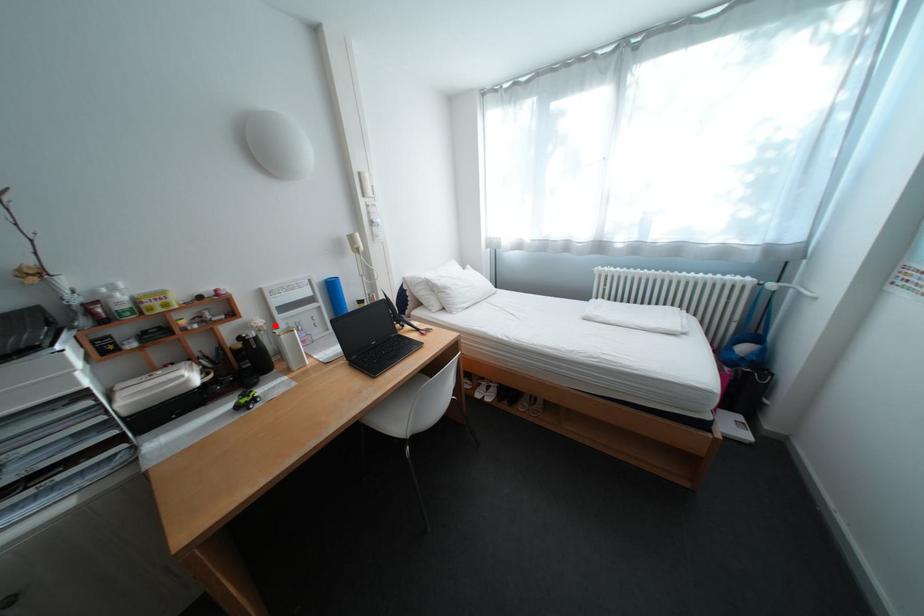
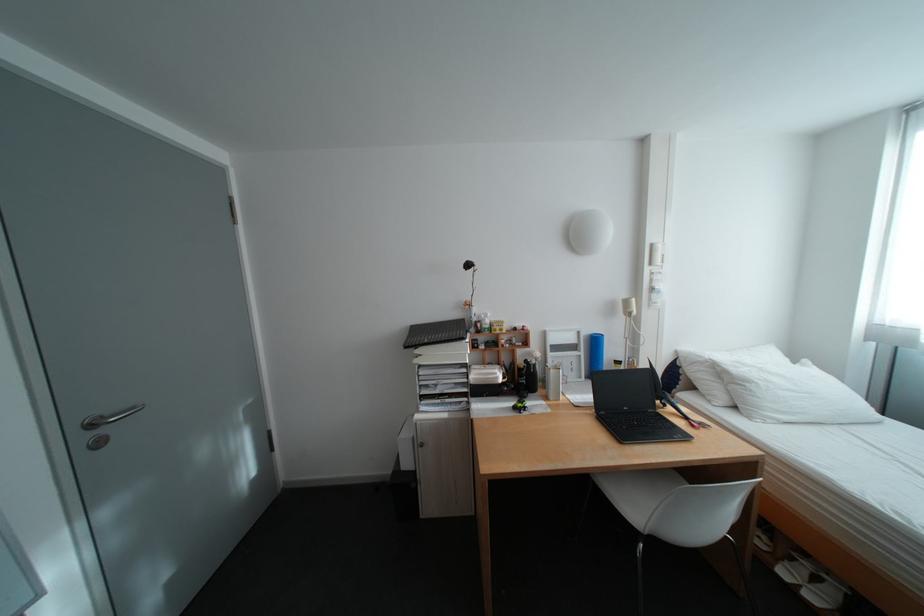
Find the pixel in the second image that matches the highlighted location in the first image.

(552, 358)